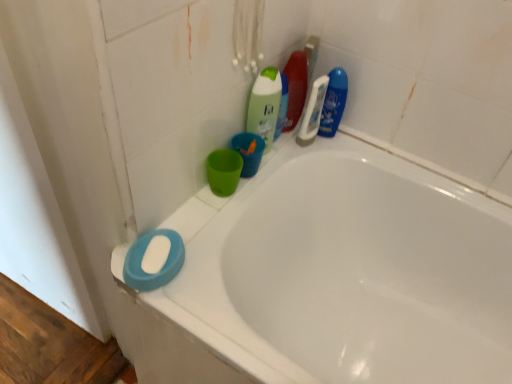
Locate an element on the screen. free space that is in between blue glossy bottle at upper right, the 4th cleaning product from the left, and white matte soap at lower left is located at coordinates (255, 188).